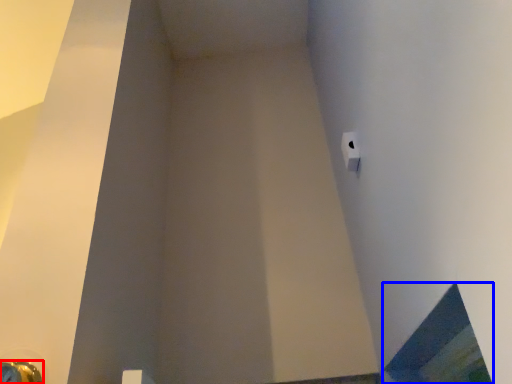
Question: Which object appears closest to the camera in this image, door handle (highlighted by a red box) or window (highlighted by a blue box)?

Choices:
 (A) door handle
 (B) window

Answer: (B)